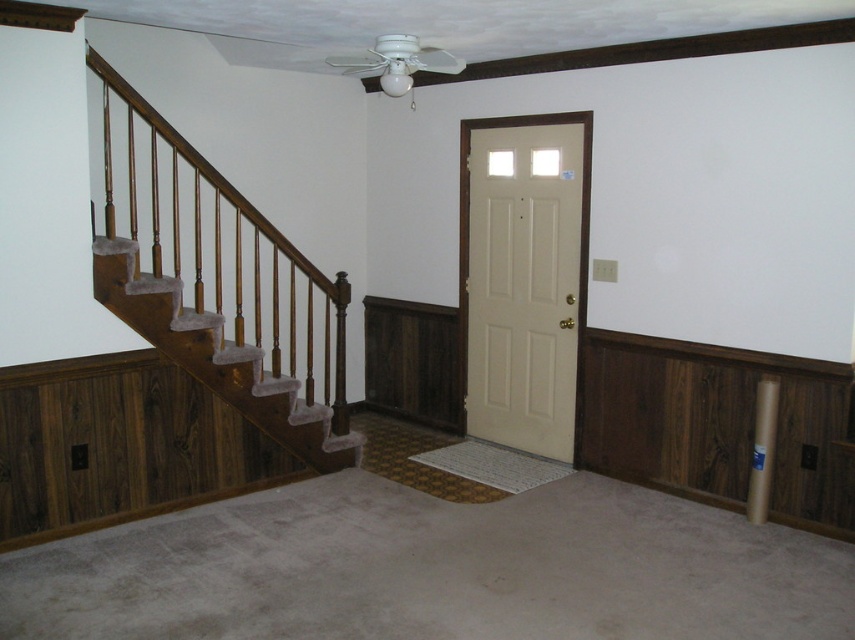
Question: Can you confirm if wooden stair railing at left is positioned above beige matte door at center?

Choices:
 (A) yes
 (B) no

Answer: (A)

Question: Considering the relative positions of wooden stair railing at left and beige matte door at center in the image provided, where is wooden stair railing at left located with respect to beige matte door at center?

Choices:
 (A) below
 (B) above

Answer: (B)

Question: Among these points, which one is nearest to the camera?

Choices:
 (A) (517, 268)
 (B) (219, 227)

Answer: (B)

Question: Among these objects, which one is farthest from the camera?

Choices:
 (A) beige matte door at center
 (B) wooden stair railing at left

Answer: (A)

Question: In this image, where is wooden stair railing at left located relative to beige matte door at center?

Choices:
 (A) right
 (B) left

Answer: (B)